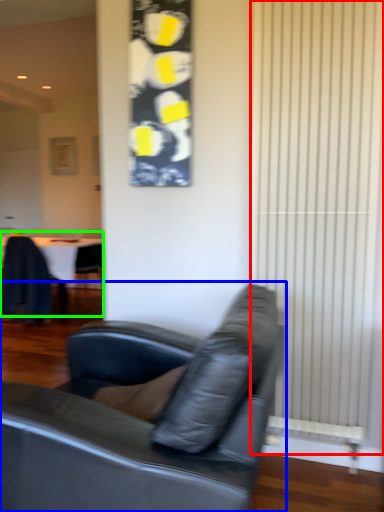
Question: Based on their relative distances, which object is nearer to curtain (highlighted by a red box)? Choose from studio couch (highlighted by a blue box) and table (highlighted by a green box).

Choices:
 (A) studio couch
 (B) table

Answer: (A)